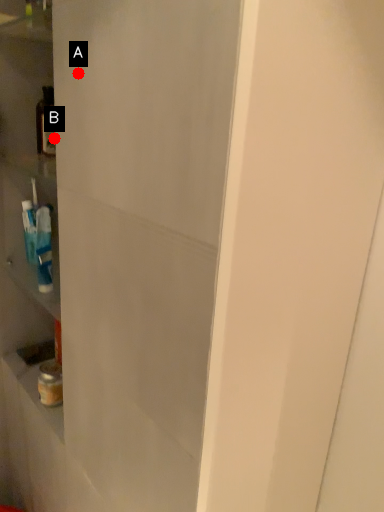
Question: Two points are circled on the image, labeled by A and B beside each circle. Which point is closer to the camera?

Choices:
 (A) A is closer
 (B) B is closer

Answer: (A)